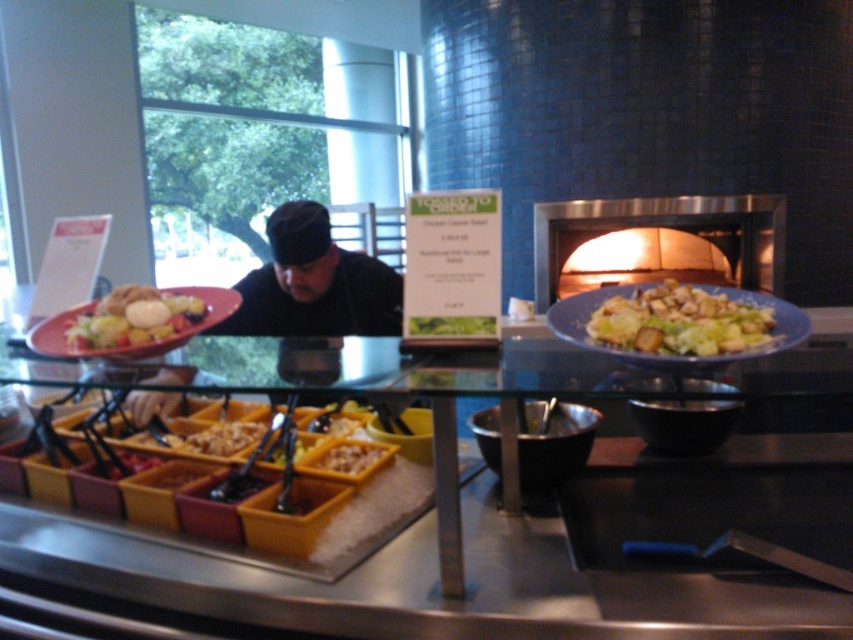
How distant is black fabric at center from matte white salad at center?

black fabric at center is 62.62 centimeters away from matte white salad at center.

Does black fabric at center appear over matte white salad at center?

Yes.

Who is more distant from viewer, (x=323, y=316) or (x=137, y=304)?

The point (x=323, y=316) is more distant.

The width and height of the screenshot is (853, 640). Find the location of `black fabric at center`. black fabric at center is located at coordinates (314, 284).

Can you confirm if black fabric at center is positioned above matte brown croutons at center?

Correct, black fabric at center is located above matte brown croutons at center.

Which of these two, black fabric at center or matte brown croutons at center, stands shorter?

matte brown croutons at center

The width and height of the screenshot is (853, 640). Find the location of `black fabric at center`. black fabric at center is located at coordinates (314, 284).

Which is above, matte white salad at center or yellow plastic tray at center?

Positioned higher is matte white salad at center.

Does matte white salad at center appear on the right side of yellow plastic tray at center?

No, matte white salad at center is not to the right of yellow plastic tray at center.

Does point (171, 298) come in front of point (358, 467)?

That is True.

This screenshot has width=853, height=640. What are the coordinates of `matte white salad at center` in the screenshot? It's located at (135, 317).